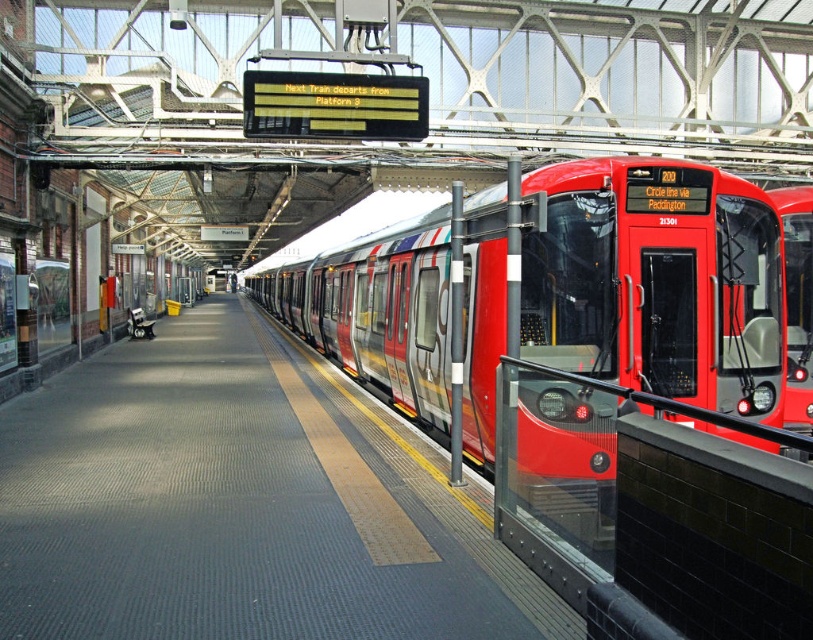
Does smooth concrete platform at center appear on the left side of metallic red train at center?

Correct, you'll find smooth concrete platform at center to the left of metallic red train at center.

Measure the distance between smooth concrete platform at center and metallic red train at center.

They are 2.66 meters apart.

Who is more forward, (146, 348) or (667, 324)?

Point (667, 324)

Locate an element on the screen. The width and height of the screenshot is (813, 640). smooth concrete platform at center is located at coordinates (242, 502).